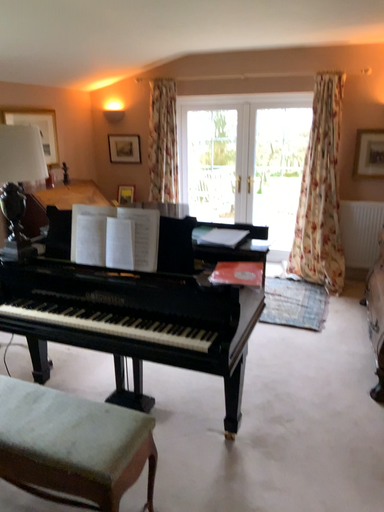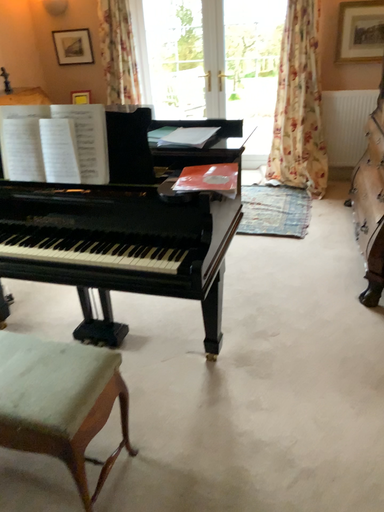
Question: How did the camera likely rotate when shooting the video?

Choices:
 (A) rotated downward
 (B) rotated upward

Answer: (A)